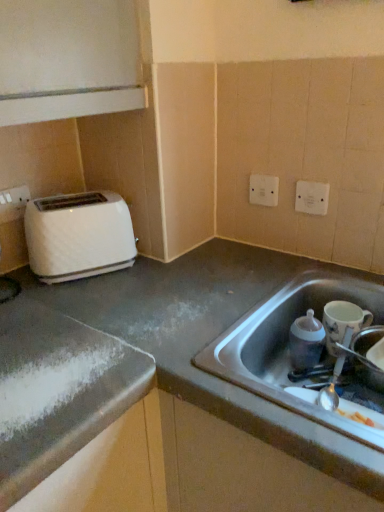
Find the location of `free space in front of white plastic toaster at left`. free space in front of white plastic toaster at left is located at coordinates (83, 301).